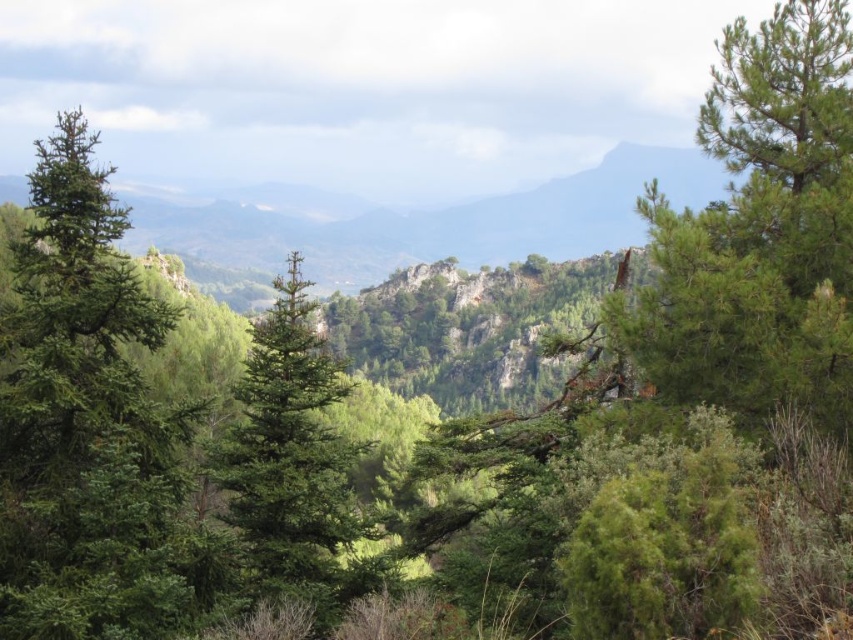
Question: Is green matte tree at left bigger than green matte tree at center?

Choices:
 (A) no
 (B) yes

Answer: (B)

Question: Can you confirm if green needle-like at center is wider than green matte tree at left?

Choices:
 (A) no
 (B) yes

Answer: (A)

Question: Is green matte tree at left further to camera compared to green matte tree at center?

Choices:
 (A) yes
 (B) no

Answer: (B)

Question: Which point appears farthest from the camera in this image?

Choices:
 (A) (26, 394)
 (B) (375, 536)
 (C) (486, 486)

Answer: (C)

Question: Among these objects, which one is nearest to the camera?

Choices:
 (A) green needle-like at center
 (B) green matte tree at left

Answer: (A)

Question: Which point is farther to the camera?

Choices:
 (A) (296, 259)
 (B) (465, 497)
 (C) (61, 428)

Answer: (B)